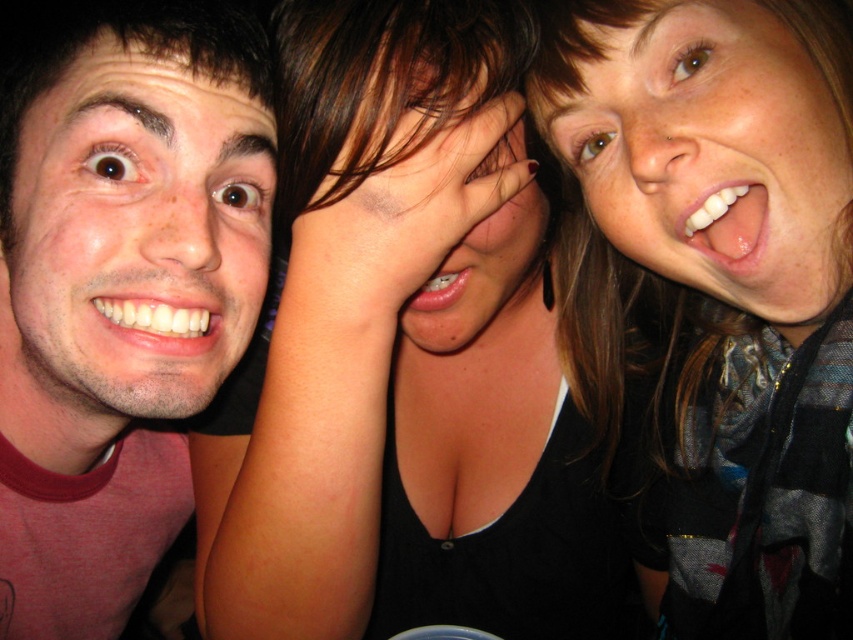
You are a photographer trying to capture a closeup shot of the white glossy teeth at upper right and the pink glossy lips at center. Which one is located more to the right side of the image?

The white glossy teeth at upper right is positioned on the right side of the pink glossy lips at center, so the white glossy teeth at upper right is more to the right.

You are a photographer checking the composition of the image. You notice the white glossy teeth at upper right and the pink glossy lips at center. Which one is positioned higher in the frame?

The white glossy teeth at upper right is above the pink glossy lips at center, so it is positioned higher in the frame.